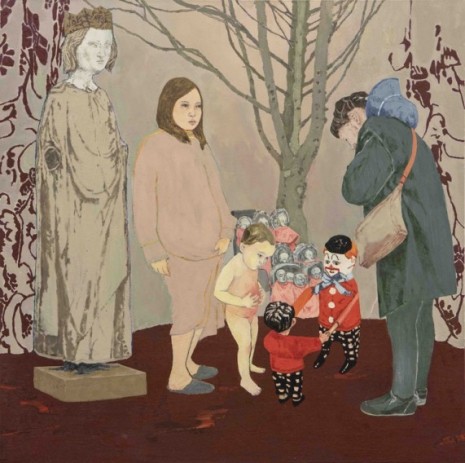
Identify the location of coat. This screenshot has height=463, width=465. tap(431, 224).